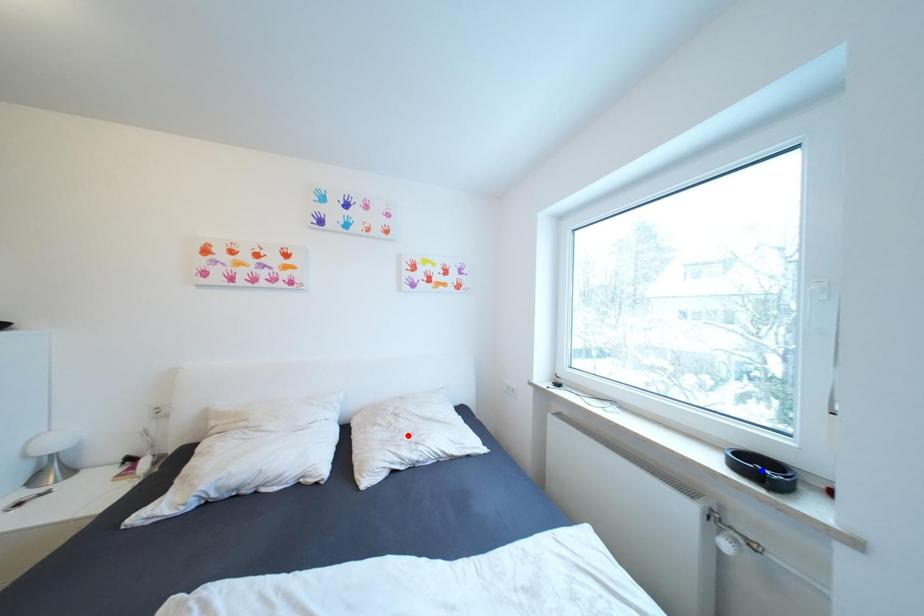
Question: Which of the two points in the image is closer to the camera?

Choices:
 (A) Blue point is closer.
 (B) Red point is closer.

Answer: (A)